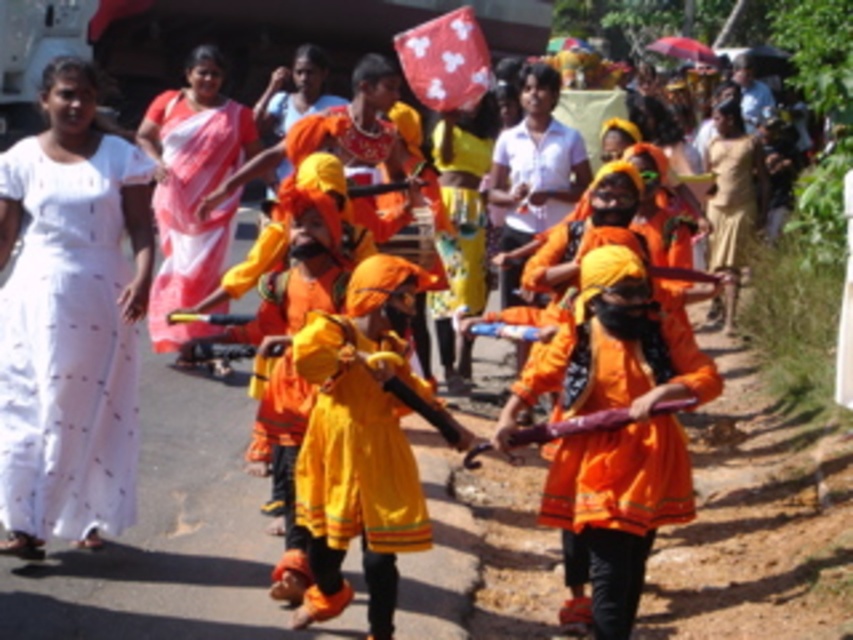
Question: Does matte orange dress at center lie in front of white silk saree at upper left?

Choices:
 (A) no
 (B) yes

Answer: (B)

Question: Which object is positioned closest to the matte orange dress at center?

Choices:
 (A) white cotton dress at left
 (B) brown cotton saree at right

Answer: (A)

Question: Which object is positioned farthest from the brown cotton saree at right?

Choices:
 (A) white cotton dress at left
 (B) matte orange dress at center
 (C) white silk saree at upper left

Answer: (B)

Question: Which point is closer to the camera?

Choices:
 (A) white silk saree at upper left
 (B) brown cotton saree at right
 (C) white cotton dress at left

Answer: (C)

Question: Is white cotton dress at left above white silk saree at upper left?

Choices:
 (A) no
 (B) yes

Answer: (A)

Question: Does white cotton dress at left appear on the right side of white silk saree at upper left?

Choices:
 (A) no
 (B) yes

Answer: (A)